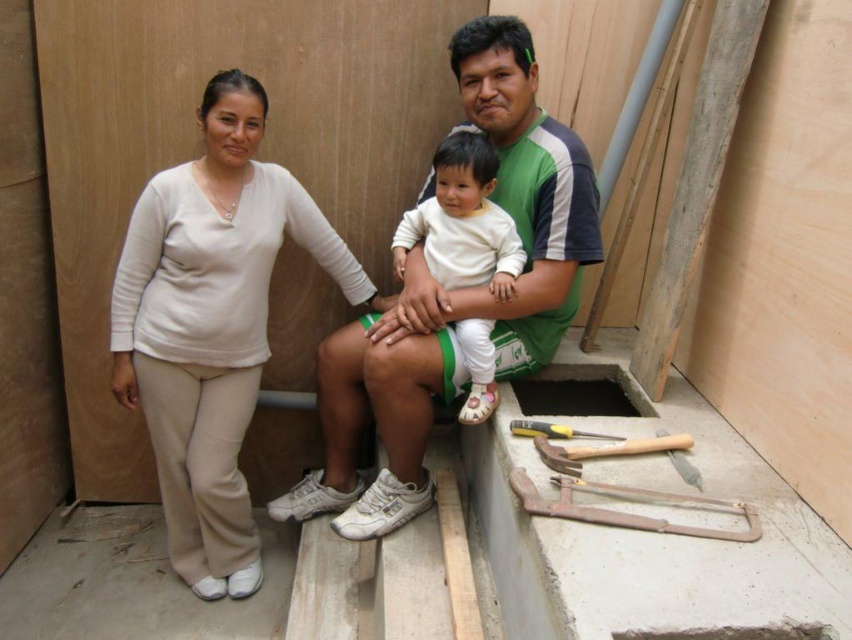
You are a delivery robot with a width of 1 meter. You need to move from the beige fabric pants at left to the yellow plastic screwdriver at lower center. Is there enough space for you to pass through?

The distance between the beige fabric pants at left and the yellow plastic screwdriver at lower center is 1.15 meters. Since the robot is 1 meter wide, there is sufficient space for it to pass through.

You are a safety inspector checking the construction site. You notice the beige fabric pants at left and the rusty metal saw at lower right. According to safety protocols, which object should be moved to ensure the path between them is clear?

The rusty metal saw at lower right should be moved because it is behind the beige fabric pants at left, blocking the path between them.

You are a construction worker who needs to reach the yellow plastic screwdriver at lower center. The beige fabric pants at left belong to your colleague. Can you easily access the screwdriver without moving the pants?

The beige fabric pants at left are closer to you than the yellow plastic screwdriver at lower center, so you would need to move the pants to access the screwdriver.